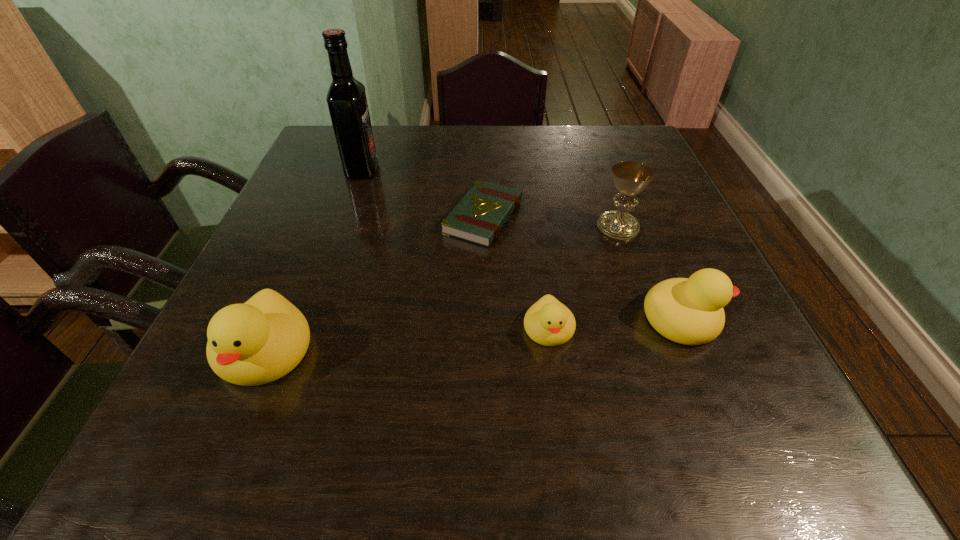
Where is `blank space located 0.340m on the front-facing side of the farthest object`? This screenshot has width=960, height=540. blank space located 0.340m on the front-facing side of the farthest object is located at coordinates (506, 170).

The image size is (960, 540). Find the location of `vacant space situated 0.300m on the front of the chalice`. vacant space situated 0.300m on the front of the chalice is located at coordinates (662, 353).

Where is `vacant space located 0.140m on the right of the shortest object`? Image resolution: width=960 pixels, height=540 pixels. vacant space located 0.140m on the right of the shortest object is located at coordinates (584, 217).

The width and height of the screenshot is (960, 540). In order to click on object that is positioned at the far edge in this screenshot , I will do [x=346, y=98].

Identify the location of object present at the near edge. (257, 342).

Locate an element on the screen. This screenshot has width=960, height=540. duckling situated at the left edge is located at coordinates (257, 342).

Identify the location of liquor present at the left edge. (346, 98).

The height and width of the screenshot is (540, 960). What are the coordinates of `duckling present at the right edge` in the screenshot? It's located at (690, 311).

Identify the location of chalice located in the right edge section of the desktop. (630, 178).

Where is `object positioned at the far left corner`? object positioned at the far left corner is located at coordinates (346, 98).